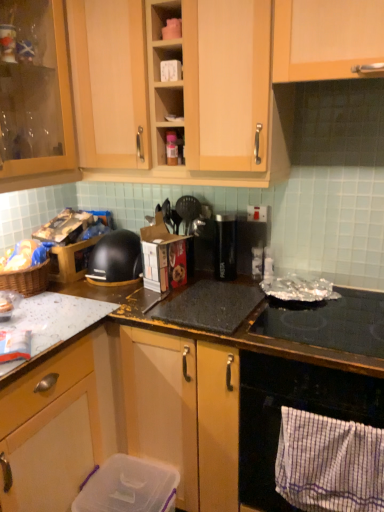
The height and width of the screenshot is (512, 384). I want to click on clear plastic container at lower center, which is counted as the first appliance, starting from the bottom, so click(128, 487).

Find the location of a particular element. This screenshot has width=384, height=512. white matte cup at upper center is located at coordinates (167, 63).

How much space does black plastic toaster at center, positioned as the 1th appliance in right-to-left order, occupy vertically?

black plastic toaster at center, positioned as the 1th appliance in right-to-left order, is 9.76 inches tall.

Locate an element on the screen. black matte bowl at center-left is located at coordinates (115, 259).

What do you see at coordinates (325, 38) in the screenshot?
I see `light wood cabinet at upper center, which ranks as the 1th cabinetry in left-to-right order` at bounding box center [325, 38].

I want to click on metallic silver cooking utensils at center, which appears as the third appliance when viewed from the right, so click(x=188, y=210).

Locate an element on the screen. Image resolution: width=384 pixels, height=512 pixels. black granite countertop at center is located at coordinates (171, 409).

Is black granite countertop at center facing away from light wood cabinet at upper center, the 2th cabinetry viewed from the right?

No, black granite countertop at center's orientation is not away from light wood cabinet at upper center, the 2th cabinetry viewed from the right.

Which of these two, black granite countertop at center or light wood cabinet at upper center, the 2th cabinetry viewed from the right, is bigger?

Bigger between the two is black granite countertop at center.

Considering the points (191, 375) and (308, 76), which point is in front, point (191, 375) or point (308, 76)?

The point (308, 76) is closer to the camera.

Is black granite countertop at center in front of light wood cabinet at upper center, which ranks as the 1th cabinetry in left-to-right order?

Yes, it is.

From the picture: Which of these two, white matte cup at upper center or clear plastic container at lower center, which is counted as the first appliance, starting from the bottom, is wider?

clear plastic container at lower center, which is counted as the first appliance, starting from the bottom.

The height and width of the screenshot is (512, 384). I want to click on shelf above the clear plastic container at lower center, the fourth appliance from the top (from a real-world perspective), so click(167, 63).

From a real-world perspective, between white matte cup at upper center and clear plastic container at lower center, which is counted as the first appliance, starting from the bottom, who is vertically higher?

white matte cup at upper center.

In the scene shown: In terms of height, does white matte cup at upper center look taller or shorter compared to clear plastic container at lower center, the fourth appliance from the top?

white matte cup at upper center is shorter than clear plastic container at lower center, the fourth appliance from the top.

The height and width of the screenshot is (512, 384). Find the location of `gas stove located above the white striped towel at lower right (from the image's perspective)`. gas stove located above the white striped towel at lower right (from the image's perspective) is located at coordinates (329, 322).

Which point is more forward, (286, 474) or (293, 315)?

Point (286, 474)

Is white striped towel at lower right beside shiny black glass at lower right?

No, white striped towel at lower right is not next to shiny black glass at lower right.

Is white striped towel at lower right bigger or smaller than shiny black glass at lower right?

Considering their sizes, white striped towel at lower right takes up more space than shiny black glass at lower right.

What's the angular difference between white striped towel at lower right and black matte bowl at center-left's facing directions?

There is a 2.81-degree angle between the facing directions of white striped towel at lower right and black matte bowl at center-left.

Does point (305, 454) appear closer or farther from the camera than point (124, 256)?

Clearly, point (305, 454) is closer to the camera than point (124, 256).

From a real-world perspective, is white striped towel at lower right beneath black matte bowl at center-left?

Indeed, from a real-world perspective, white striped towel at lower right is positioned beneath black matte bowl at center-left.

From a real-world perspective, who is located higher, matte brown chips in basket at left or metallic silver cooking utensils at center, arranged as the 4th appliance when ordered from the bottom?

metallic silver cooking utensils at center, arranged as the 4th appliance when ordered from the bottom, is physically above.

Which of these two, matte brown chips in basket at left or metallic silver cooking utensils at center, the 1th appliance viewed from the top, stands taller?

Standing taller between the two is metallic silver cooking utensils at center, the 1th appliance viewed from the top.

Looking at this image, does matte brown chips in basket at left appear on the right side of metallic silver cooking utensils at center, the 1th appliance viewed from the top?

No.

Which is behind, matte brown chips in basket at left or metallic silver cooking utensils at center, which appears as the third appliance when viewed from the right?

metallic silver cooking utensils at center, which appears as the third appliance when viewed from the right, is further away from the camera.

Is black matte bowl at center-left not close to shiny black glass at lower right?

black matte bowl at center-left is near shiny black glass at lower right, not far away.

Is black matte bowl at center-left behind shiny black glass at lower right?

Yes, black matte bowl at center-left is further from the viewer.

Based on their sizes in the image, would you say black matte bowl at center-left is bigger or smaller than shiny black glass at lower right?

Clearly, black matte bowl at center-left is larger in size than shiny black glass at lower right.

Is shiny black glass at lower right a part of black matte bowl at center-left?

No, shiny black glass at lower right is not a part of black matte bowl at center-left.

From a real-world perspective, is black plastic toaster at center, positioned as the 1th appliance in right-to-left order, positioned over shiny black glass at lower right based on gravity?

Yes, from a real-world perspective, black plastic toaster at center, positioned as the 1th appliance in right-to-left order, is over shiny black glass at lower right

Which is closer, (241,251) or (250,330)?

Point (241,251) is farther from the camera than point (250,330).

Does black plastic toaster at center, which is the fourth appliance from left to right, have a lesser width compared to shiny black glass at lower right?

Yes.

Where is `gas stove that is under the black plastic toaster at center, which is the 2th appliance from bottom to top (from a real-world perspective)`? This screenshot has width=384, height=512. gas stove that is under the black plastic toaster at center, which is the 2th appliance from bottom to top (from a real-world perspective) is located at coordinates (329, 322).

From a real-world perspective, starting from the black granite countertop at center, which cabinetry is the 1st one vertically above it? Please provide its 2D coordinates.

[(325, 38)]

The height and width of the screenshot is (512, 384). What are the coordinates of `appliance that is the 4th one below the white matte cup at upper center (from a real-world perspective)` in the screenshot? It's located at (128, 487).

Looking at the image, which one is located closer to clear plastic container at lower center, the fourth appliance viewed from the right, black plastic toaster at center, which is the 2th appliance from bottom to top, or light wood cabinet at upper center, the 2th cabinetry viewed from the right?

black plastic toaster at center, which is the 2th appliance from bottom to top, is closer to clear plastic container at lower center, the fourth appliance viewed from the right.

When comparing their distances from black glass oven at lower right, does black matte bowl at center-left or black granite countertop at center seem further?

black matte bowl at center-left lies further to black glass oven at lower right than the other object.

Considering their positions, is black matte bowl at center-left positioned further to black glass oven at lower right than light wood cabinet at upper center, placed as the 2th cabinetry when sorted from left to right?

The object further to black glass oven at lower right is light wood cabinet at upper center, placed as the 2th cabinetry when sorted from left to right.

Which object lies nearer to the anchor point shiny black glass at lower right, black granite countertop at center or black matte bowl at center-left?

Among the two, black granite countertop at center is located nearer to shiny black glass at lower right.

Considering their positions, is clear plastic container at lower center, which is counted as the first appliance, starting from the bottom, positioned closer to black glass oven at lower right than white matte cup at upper center?

clear plastic container at lower center, which is counted as the first appliance, starting from the bottom.

When comparing their distances from clear plastic container at lower center, which is counted as the first appliance, starting from the bottom, does black granite countertop at center or shiny black glass at lower right seem closer?

Among the two, black granite countertop at center is located nearer to clear plastic container at lower center, which is counted as the first appliance, starting from the bottom.

Estimate the real-world distances between objects in this image. Which object is closer to metallic silver cooking utensils at center, arranged as the 4th appliance when ordered from the bottom, black plastic toaster at center, which appears as the 3th appliance when ordered from the bottom, or matte brown chips in basket at left?

black plastic toaster at center, which appears as the 3th appliance when ordered from the bottom.

Based on their spatial positions, is clear plastic container at lower center, the fourth appliance viewed from the right, or light wood cabinet at upper center, placed as the 2th cabinetry when sorted from left to right, further from black matte bowl at center-left?

light wood cabinet at upper center, placed as the 2th cabinetry when sorted from left to right.

Locate an element on the screen. Image resolution: width=384 pixels, height=512 pixels. food between light wood cabinet at upper center, placed as the 2th cabinetry when sorted from left to right, and black granite countertop at center, in the vertical direction is located at coordinates (25, 256).

I want to click on cabinetry between white matte cup at upper center and black plastic toaster at center, acting as the 2th appliance starting from the top, in the vertical direction, so click(x=325, y=38).

Where is `gas stove between light wood cabinet at upper center, which ranks as the 1th cabinetry in left-to-right order, and black glass oven at lower right in the up-down direction`? gas stove between light wood cabinet at upper center, which ranks as the 1th cabinetry in left-to-right order, and black glass oven at lower right in the up-down direction is located at coordinates (329, 322).

At what (x,y) coordinates should I click in order to perform the action: click on kitchen appliance between light wood cabinet at upper center, the 2th cabinetry viewed from the right, and white striped towel at lower right from top to bottom. Please return your answer as a coordinate pair (x, y). Image resolution: width=384 pixels, height=512 pixels. Looking at the image, I should click on (115, 259).